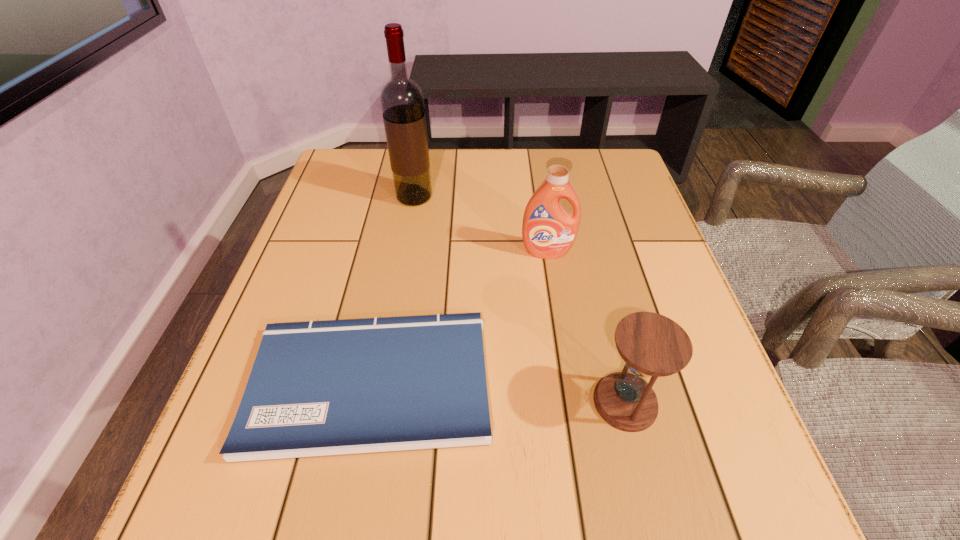
At what (x,y) coordinates should I click in order to perform the action: click on empty location between the third tallest object and the shortest object. Please return your answer as a coordinate pair (x, y). The image size is (960, 540). Looking at the image, I should click on (497, 393).

Identify the location of free spot between the hourglass and the third nearest object. The height and width of the screenshot is (540, 960). (586, 327).

Identify the location of free spot between the paperback book and the farthest object. The height and width of the screenshot is (540, 960). (392, 290).

This screenshot has height=540, width=960. I want to click on vacant area that lies between the paperback book and the second shortest object, so click(497, 393).

Find the location of `free space that is in between the paperback book and the hourglass`. free space that is in between the paperback book and the hourglass is located at coordinates (497, 393).

Find the location of `vacant space that is in between the wine bottle and the hourglass`. vacant space that is in between the wine bottle and the hourglass is located at coordinates (520, 300).

Locate an element on the screen. The image size is (960, 540). empty space between the third tallest object and the paperback book is located at coordinates (497, 393).

Locate an element on the screen. vacant space that's between the farthest object and the hourglass is located at coordinates (520, 300).

Image resolution: width=960 pixels, height=540 pixels. I want to click on the second closest object to the detergent, so click(x=402, y=102).

Where is `the closest object to the farthest object`? This screenshot has height=540, width=960. the closest object to the farthest object is located at coordinates (548, 230).